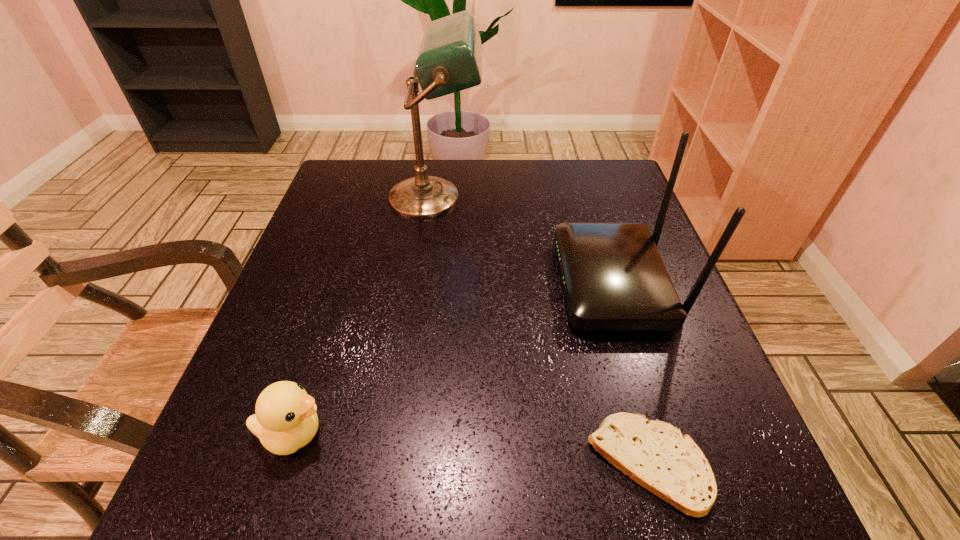
Where is `free space located on the face of the third tallest object`? free space located on the face of the third tallest object is located at coordinates (396, 434).

Identify the location of free region located on the back of the shortest object. The image size is (960, 540). (593, 262).

Find the location of a particular element. This screenshot has width=960, height=540. object that is at the far edge is located at coordinates (449, 60).

At what (x,y) coordinates should I click in order to perform the action: click on duck that is at the near edge. Please return your answer as a coordinate pair (x, y). Looking at the image, I should click on (285, 419).

Locate an element on the screen. The image size is (960, 540). pita bread that is at the near edge is located at coordinates (654, 454).

What are the coordinates of `object that is positioned at the left edge` in the screenshot? It's located at (285, 419).

Where is `router that is at the right edge`? This screenshot has width=960, height=540. router that is at the right edge is located at coordinates (614, 279).

The width and height of the screenshot is (960, 540). I want to click on pita bread that is at the right edge, so click(x=654, y=454).

Identify the location of object that is at the near left corner. The image size is (960, 540). (285, 419).

Where is `object present at the near right corner`? object present at the near right corner is located at coordinates (654, 454).